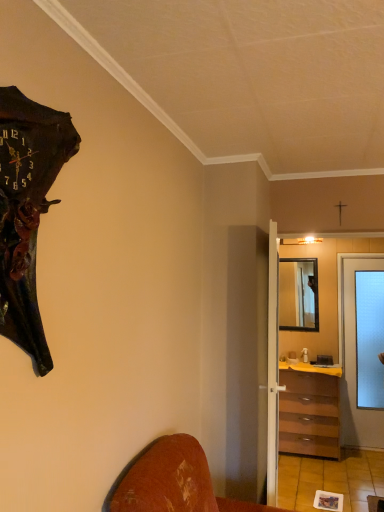
Question: Is yellow laminate counter top at center bigger than transparent glass door at right, which appears as the 2th door when viewed from the left?

Choices:
 (A) yes
 (B) no

Answer: (B)

Question: Is yellow laminate counter top at center to the left of transparent glass door at right, which is the second door in front-to-back order, from the viewer's perspective?

Choices:
 (A) no
 (B) yes

Answer: (B)

Question: From the image's perspective, is yellow laminate counter top at center under transparent glass door at right, the 1th door when ordered from back to front?

Choices:
 (A) yes
 (B) no

Answer: (A)

Question: Does yellow laminate counter top at center come behind transparent glass door at right, which is the second door in front-to-back order?

Choices:
 (A) yes
 (B) no

Answer: (B)

Question: Is yellow laminate counter top at center thinner than transparent glass door at right, acting as the first door starting from the right?

Choices:
 (A) yes
 (B) no

Answer: (B)

Question: Is yellow laminate counter top at center directly adjacent to transparent glass door at right, which is the second door in front-to-back order?

Choices:
 (A) no
 (B) yes

Answer: (A)

Question: Can you confirm if dark brown wooden wall clock at left is taller than brown wooden chest of drawers at center-right?

Choices:
 (A) yes
 (B) no

Answer: (B)

Question: From a real-world perspective, is dark brown wooden wall clock at left below brown wooden chest of drawers at center-right?

Choices:
 (A) no
 (B) yes

Answer: (A)

Question: Would you say dark brown wooden wall clock at left contains brown wooden chest of drawers at center-right?

Choices:
 (A) no
 (B) yes

Answer: (A)

Question: Are dark brown wooden wall clock at left and brown wooden chest of drawers at center-right beside each other?

Choices:
 (A) yes
 (B) no

Answer: (B)

Question: From the image's perspective, is dark brown wooden wall clock at left under brown wooden chest of drawers at center-right?

Choices:
 (A) yes
 (B) no

Answer: (B)

Question: Does dark brown wooden wall clock at left come behind brown wooden chest of drawers at center-right?

Choices:
 (A) yes
 (B) no

Answer: (B)

Question: Is transparent frosted glass screen door at center-right at the left side of wooden framed mirror at center?

Choices:
 (A) yes
 (B) no

Answer: (A)